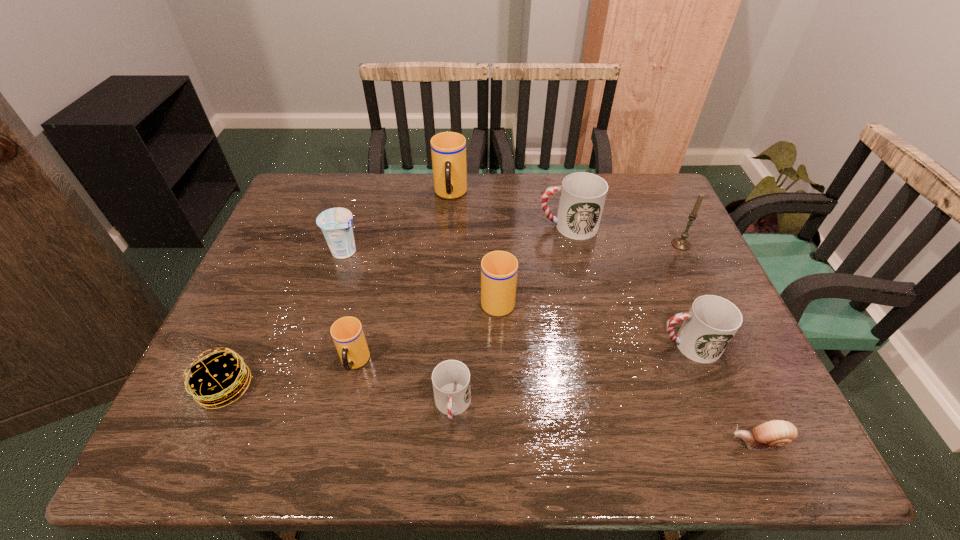
In order to click on free spot located 0.170m on the side of the biggest red cup where the handle is located in this screenshot , I will do `click(481, 226)`.

Image resolution: width=960 pixels, height=540 pixels. What are the coordinates of `vacant space situated 0.100m on the side of the biggest red cup where the handle is located` in the screenshot? It's located at (504, 226).

You are a GUI agent. You are given a task and a screenshot of the screen. Output one action in this format:
    pyautogui.click(x=<x>, y=<y>)
    Task: Click on the vacant position located on the side of the biggest red cup where the handle is located
    The width and height of the screenshot is (960, 540).
    Given the screenshot: What is the action you would take?
    pyautogui.click(x=418, y=226)

Image resolution: width=960 pixels, height=540 pixels. I want to click on vacant space located on the side of the sixth object from left to right with the handle, so click(x=494, y=200).

Find the location of a particular element. vacant position located on the side of the sixth object from left to right with the handle is located at coordinates (495, 241).

This screenshot has width=960, height=540. I want to click on free space located on the side of the sixth object from left to right with the handle, so click(x=494, y=211).

The image size is (960, 540). Identify the location of vacant space situated on the back of the blue yogurt. (353, 225).

The image size is (960, 540). I want to click on free space located on the side of the rightmost cup where the handle is located, so click(540, 345).

You are a GUI agent. You are given a task and a screenshot of the screen. Output one action in this format:
    pyautogui.click(x=<x>, y=<y>)
    Task: Click on the free space located on the side of the rightmost cup where the handle is located
    The image size is (960, 540).
    Given the screenshot: What is the action you would take?
    pyautogui.click(x=493, y=345)

Identify the location of vacant space located 0.130m on the side of the rightmost cup where the handle is located. (602, 345).